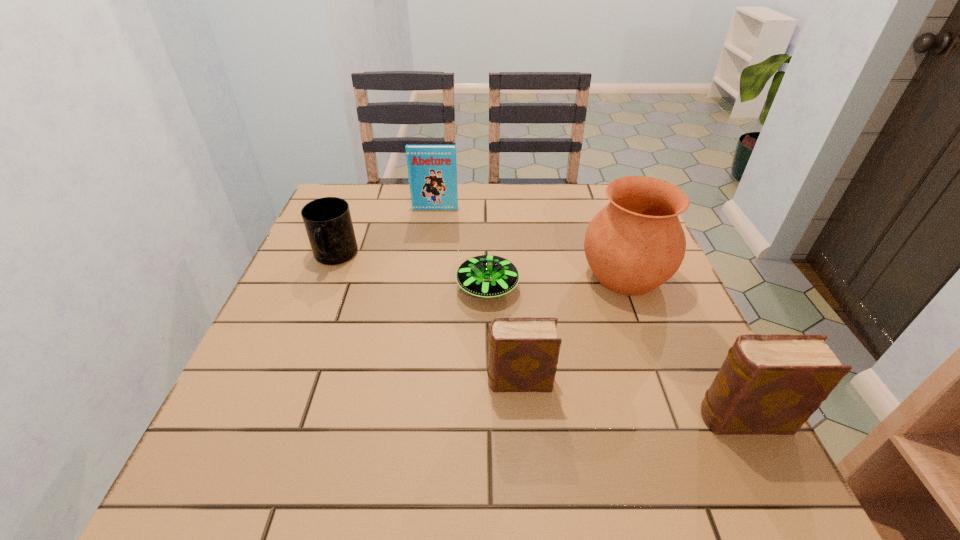
This screenshot has width=960, height=540. I want to click on the left diary, so click(523, 352).

This screenshot has width=960, height=540. In order to click on the shorter diary in this screenshot , I will do `click(523, 352)`.

Identify the location of the nearer diary. (768, 384).

Identify the location of the right diary. (768, 384).

You are a GUI agent. You are given a task and a screenshot of the screen. Output one action in this format:
    pyautogui.click(x=<x>, y=<y>)
    Task: Click on the farthest object
    The height and width of the screenshot is (540, 960).
    Given the screenshot: What is the action you would take?
    pos(432,170)

Image resolution: width=960 pixels, height=540 pixels. Find the location of `the fifth object from right to left`. the fifth object from right to left is located at coordinates (432, 170).

Identify the location of the leftmost object. This screenshot has width=960, height=540. (328, 223).

Identify the location of saucer. The width and height of the screenshot is (960, 540). (487, 276).

Image resolution: width=960 pixels, height=540 pixels. Identify the location of pottery. (636, 243).

Identify the location of vacant area situated on the spine side of the shorter diary. (420, 381).